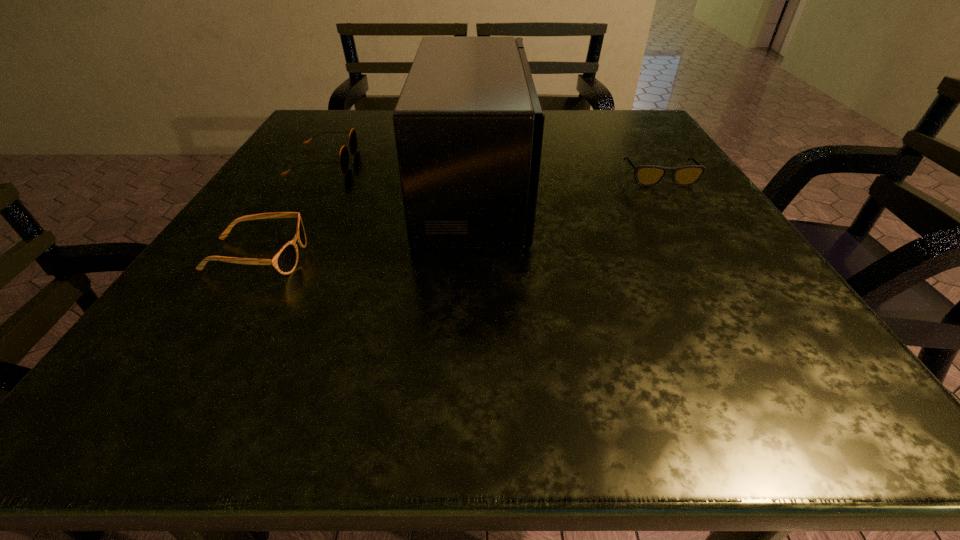
The height and width of the screenshot is (540, 960). I want to click on object at the far left corner, so click(353, 144).

Find the location of a particular element. This screenshot has width=960, height=540. blank space at the far edge of the desktop is located at coordinates (385, 124).

This screenshot has width=960, height=540. In order to click on free space at the near edge of the desktop in this screenshot , I will do `click(325, 355)`.

The image size is (960, 540). In the image, there is a desktop. What are the coordinates of `free space at the left edge` in the screenshot? It's located at (283, 178).

Where is `free space at the right edge of the desktop`? This screenshot has width=960, height=540. free space at the right edge of the desktop is located at coordinates (714, 266).

Find the location of a particular element. The image size is (960, 540). free spot at the far left corner of the desktop is located at coordinates (302, 141).

Locate an element on the screen. vacant space at the far right corner of the desktop is located at coordinates (622, 119).

Identify the location of vacant area that lies between the second object from right to left and the nearest sunglasses. click(365, 222).

The width and height of the screenshot is (960, 540). I want to click on free spot between the nearest sunglasses and the third object from left to right, so [365, 222].

I want to click on vacant space that's between the second object from right to left and the nearest sunglasses, so click(x=365, y=222).